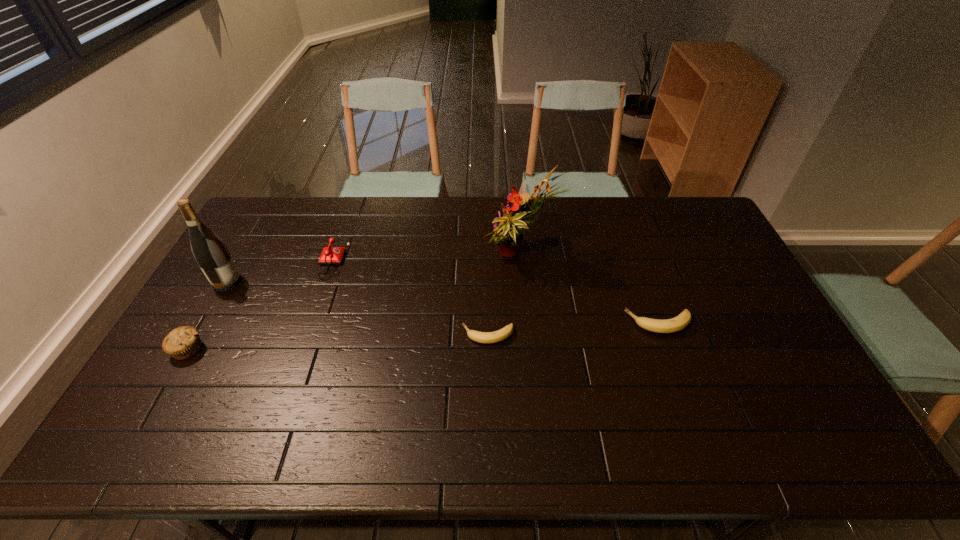
Observe the arrangement of all bananas in the image. To keep them evenly spaced, where would you place another banana on the left? Please locate a free space. Please provide its 2D coordinates. Your answer should be formatted as a tuple, i.e. [(x, y)], where the tuple contains the x and y coordinates of a point satisfying the conditions above.

[(308, 347)]